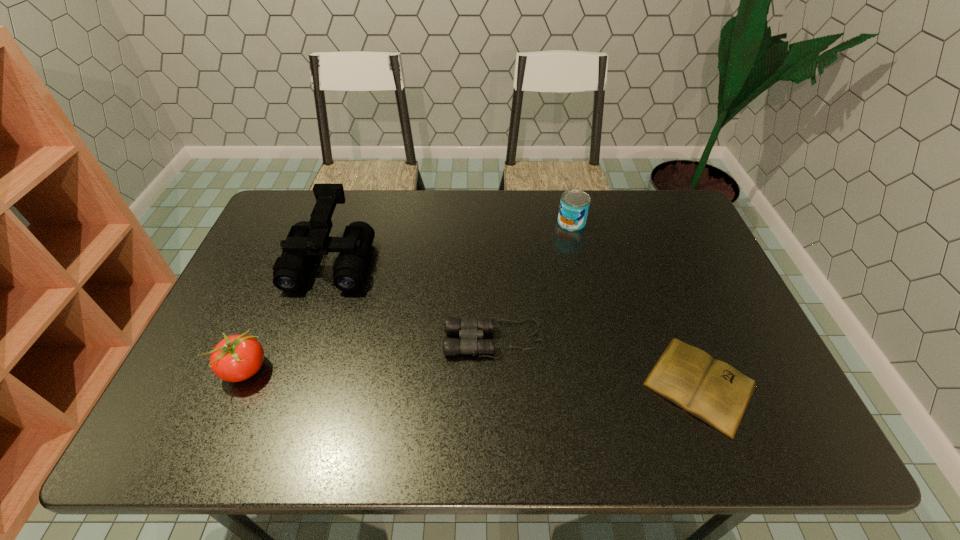
Locate an element on the screen. This screenshot has height=540, width=960. vacant point that satisfies the following two spatial constraints: 1. on the front side of the fourth object from left to right; 2. at the eyepiece of the fourth tallest object is located at coordinates (598, 339).

Identify the location of vacant space that satisfies the following two spatial constraints: 1. on the front side of the can; 2. on the right side of the shortest object. (609, 384).

Find the location of a particular element. free space that satisfies the following two spatial constraints: 1. on the front lenses of the tallest object; 2. on the right side of the book is located at coordinates (289, 384).

This screenshot has width=960, height=540. I want to click on free space that satisfies the following two spatial constraints: 1. on the front lenses of the shortest object; 2. on the left side of the farther binoculars, so click(x=289, y=384).

Where is `free spot that satisfies the following two spatial constraints: 1. on the front lenses of the book; 2. on the left side of the farther binoculars`? This screenshot has height=540, width=960. free spot that satisfies the following two spatial constraints: 1. on the front lenses of the book; 2. on the left side of the farther binoculars is located at coordinates (289, 384).